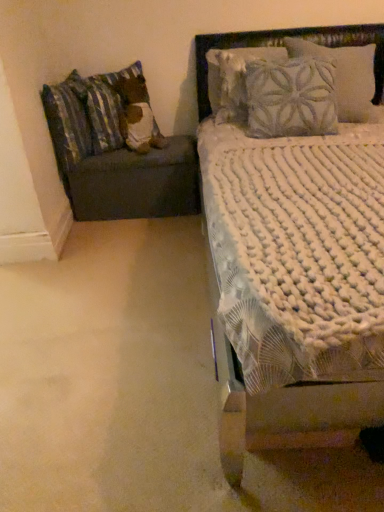
Locate an element on the screen. This screenshot has width=384, height=512. vacant location below fluffy fabric pillow at left, the 1th pillow positioned from the right (from a real-world perspective) is located at coordinates (150, 147).